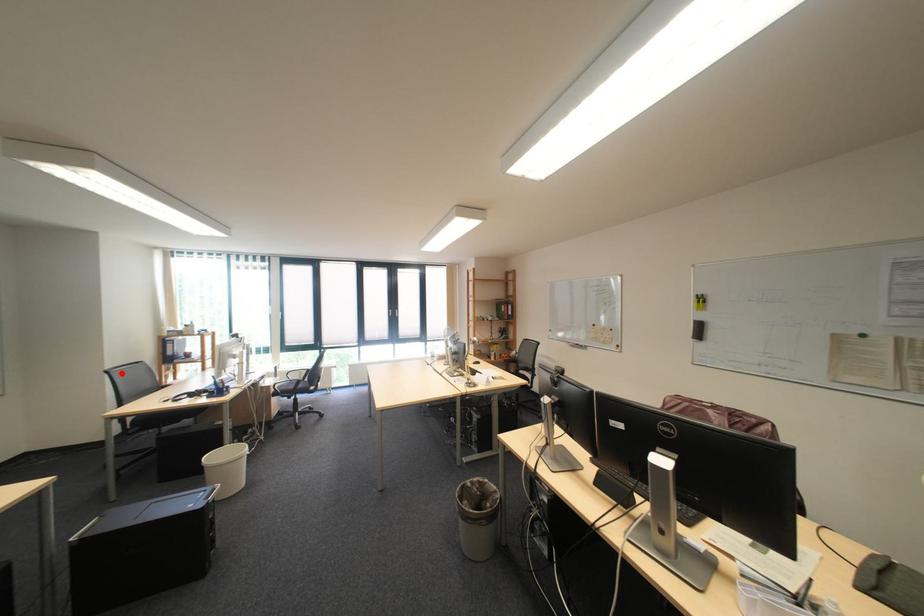
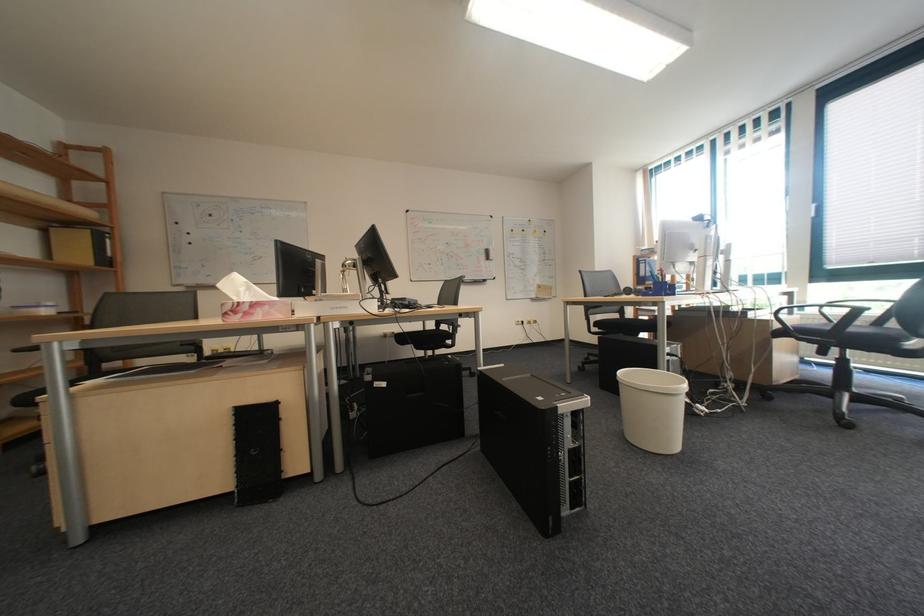
The point at the highlighted location is marked in the first image. Where is the corresponding point in the second image?

(593, 273)